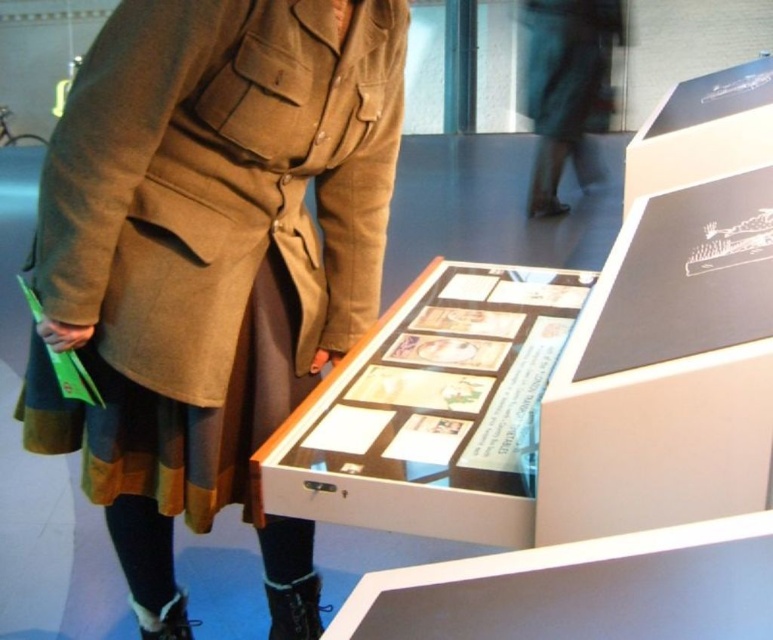
Question: Is khaki woolen coat at center thinner than dark green fabric coat at upper center?

Choices:
 (A) yes
 (B) no

Answer: (A)

Question: Does khaki woolen coat at center appear on the right side of dark green fabric coat at upper center?

Choices:
 (A) yes
 (B) no

Answer: (B)

Question: Is khaki woolen coat at center below dark green fabric coat at upper center?

Choices:
 (A) yes
 (B) no

Answer: (A)